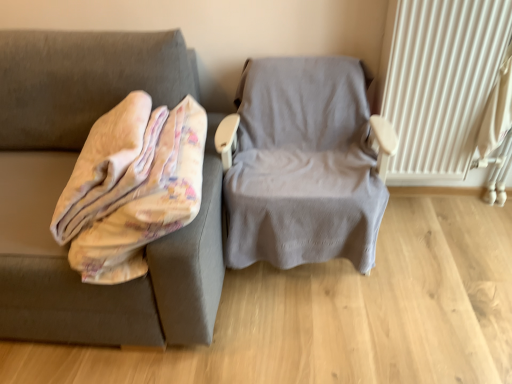
Question: Can you confirm if white textured radiator at right is taller than fluffy beige blanket at left?

Choices:
 (A) no
 (B) yes

Answer: (B)

Question: From the image's perspective, is white textured radiator at right located above fluffy beige blanket at left?

Choices:
 (A) yes
 (B) no

Answer: (A)

Question: Is white textured radiator at right with fluffy beige blanket at left?

Choices:
 (A) yes
 (B) no

Answer: (B)

Question: From the image's perspective, is white textured radiator at right under fluffy beige blanket at left?

Choices:
 (A) no
 (B) yes

Answer: (A)

Question: Can you confirm if white textured radiator at right is wider than fluffy beige blanket at left?

Choices:
 (A) yes
 (B) no

Answer: (B)

Question: From a real-world perspective, is gray fabric chair at center positioned above or below fluffy beige blanket at left?

Choices:
 (A) above
 (B) below

Answer: (B)

Question: Considering the positions of gray fabric chair at center and fluffy beige blanket at left in the image, is gray fabric chair at center bigger or smaller than fluffy beige blanket at left?

Choices:
 (A) small
 (B) big

Answer: (B)

Question: Visually, is gray fabric chair at center positioned to the left or to the right of fluffy beige blanket at left?

Choices:
 (A) right
 (B) left

Answer: (A)

Question: Considering their positions, is gray fabric chair at center located in front of or behind fluffy beige blanket at left?

Choices:
 (A) behind
 (B) front

Answer: (A)

Question: In the image, is gray fabric chair at center positioned in front of or behind white textured radiator at right?

Choices:
 (A) front
 (B) behind

Answer: (A)

Question: Is point (316, 205) closer or farther from the camera than point (470, 122)?

Choices:
 (A) closer
 (B) farther

Answer: (A)

Question: From the image's perspective, relative to white textured radiator at right, is gray fabric chair at center above or below?

Choices:
 (A) above
 (B) below

Answer: (B)

Question: Looking at their shapes, would you say gray fabric chair at center is wider or thinner than white textured radiator at right?

Choices:
 (A) thin
 (B) wide

Answer: (B)

Question: Considering the positions of white textured radiator at right and fluffy beige blanket at left in the image, is white textured radiator at right bigger or smaller than fluffy beige blanket at left?

Choices:
 (A) small
 (B) big

Answer: (A)

Question: Is white textured radiator at right inside or outside of fluffy beige blanket at left?

Choices:
 (A) inside
 (B) outside

Answer: (B)